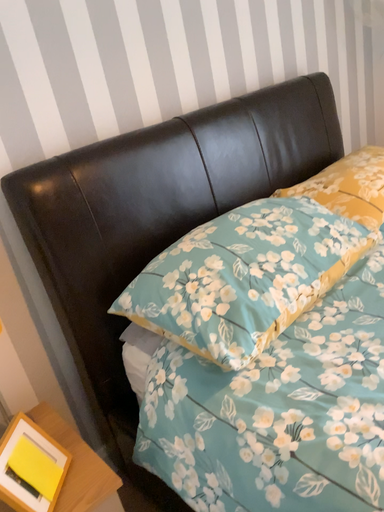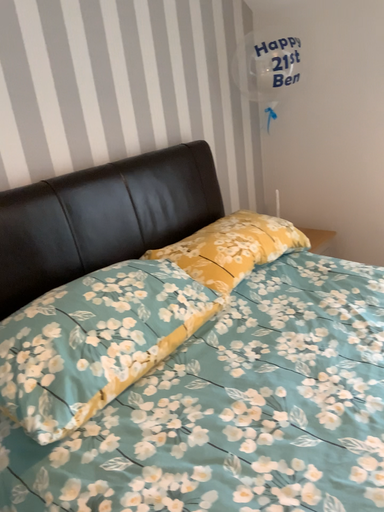
Question: Which way did the camera rotate in the video?

Choices:
 (A) rotated left
 (B) rotated right

Answer: (B)